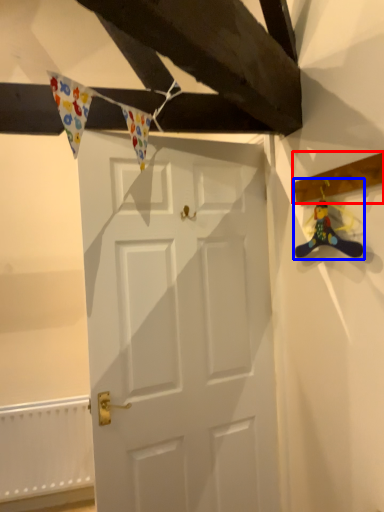
Question: Which object is closer to the camera taking this photo, plank (highlighted by a red box) or miniature (highlighted by a blue box)?

Choices:
 (A) plank
 (B) miniature

Answer: (A)